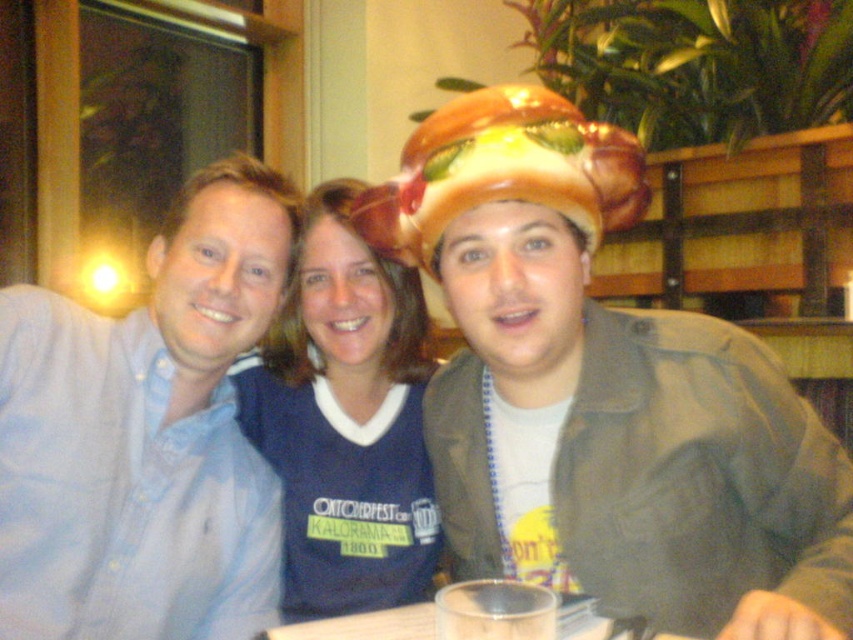
Based on the photo, you are a photographer trying to capture a group photo of the three people. You want to ensure that the matte plastic burger hat at center and the blue jersey at center are both visible in the frame. Based on their positions, which object is closer to the right edge of the photo?

The matte plastic burger hat at center is positioned on the right side of blue jersey at center, so it is closer to the right edge of the photo.

Looking at this image, you are a photographer taking a picture of the group. The matte plastic burger hat at center and transparent plastic cup at center are both in the frame. Which object is positioned higher in the image?

The matte plastic burger hat at center is located above the transparent plastic cup at center, so it is positioned higher in the image.